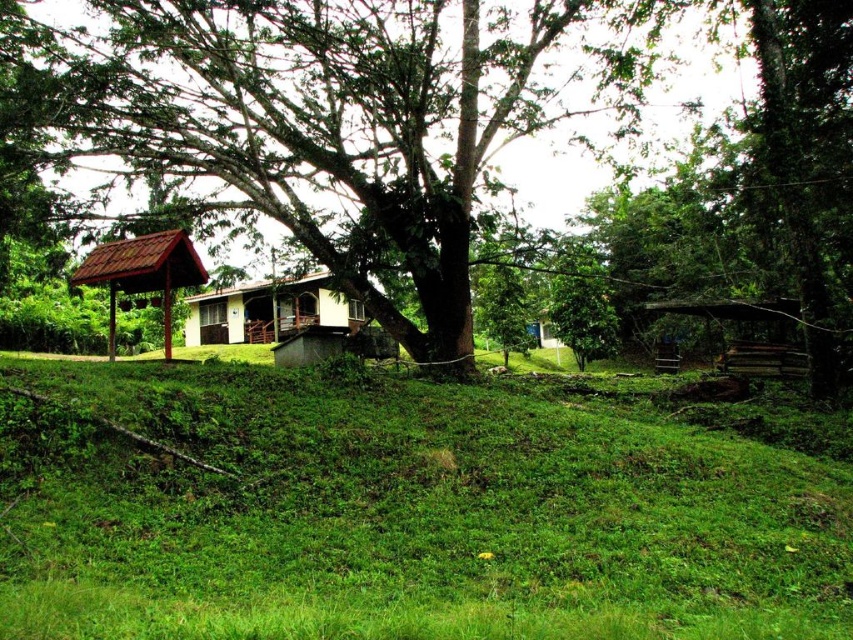
From the picture: You are standing on the grassy slope and want to take a photo of the green rough bark tree at center and the white matte house at center. Which one should you zoom in on more to ensure both are clearly visible in the frame?

The green rough bark tree at center is taller than the white matte house at center, so you should zoom in more on the tree to ensure both are clearly visible in the frame.

You are standing at the base of the slope in front of the white matte house at center and want to reach the matte brown hut at left. Which direction should you walk to get there?

The matte brown hut at left is behind the white matte house at center, so you should walk towards the back of the white matte house at center to reach the matte brown hut at left.